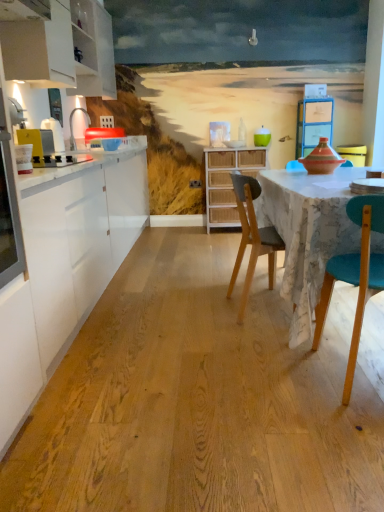
Question: Visually, is wooden chair at center positioned to the left or to the right of white glossy countertop at left?

Choices:
 (A) left
 (B) right

Answer: (B)

Question: Is point (240, 207) positioned closer to the camera than point (59, 297)?

Choices:
 (A) farther
 (B) closer

Answer: (A)

Question: Which is nearer to the white wicker cabinet at center?

Choices:
 (A) wooden chair at center
 (B) metallic silver toaster at left
 (C) white matte cabinet at upper left
 (D) teal glossy bowl at upper center
 (E) white glossy countertop at left

Answer: (D)

Question: Which of these objects is positioned farthest from the metallic silver toaster at left?

Choices:
 (A) teal glossy bowl at upper center
 (B) white wicker cabinet at center
 (C) white matte cabinet at upper left
 (D) white glossy countertop at left
 (E) wooden chair at center

Answer: (A)